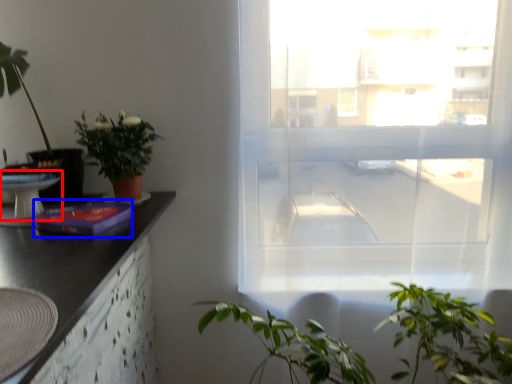
Question: Which of the following is the closest to the observer, round table (highlighted by a red box) or book (highlighted by a blue box)?

Choices:
 (A) round table
 (B) book

Answer: (B)